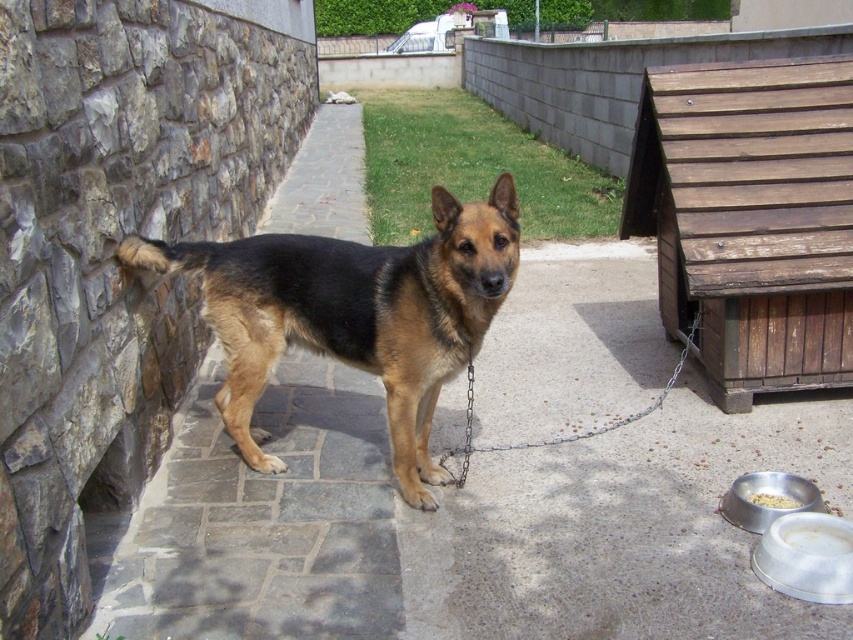
Question: Which point is farther to the camera?

Choices:
 (A) white matte bowl at lower right
 (B) black and tan fur dog at center
 (C) metallic chain at center

Answer: (A)

Question: Does brown stone pavement at center have a larger size compared to black and tan fur dog at center?

Choices:
 (A) yes
 (B) no

Answer: (A)

Question: Which object appears farthest from the camera in this image?

Choices:
 (A) black and tan fur dog at center
 (B) metallic chain at center
 (C) white matte bowl at lower right
 (D) brown stone pavement at center

Answer: (C)

Question: Is brown stone pavement at center wider than black and tan fur dog at center?

Choices:
 (A) no
 (B) yes

Answer: (B)

Question: Which point is farther to the camera?

Choices:
 (A) metallic chain at center
 (B) black and tan fur dog at center
 (C) brown stone pavement at center

Answer: (A)

Question: Can you confirm if metallic chain at center is positioned to the left of white matte bowl at lower right?

Choices:
 (A) yes
 (B) no

Answer: (A)